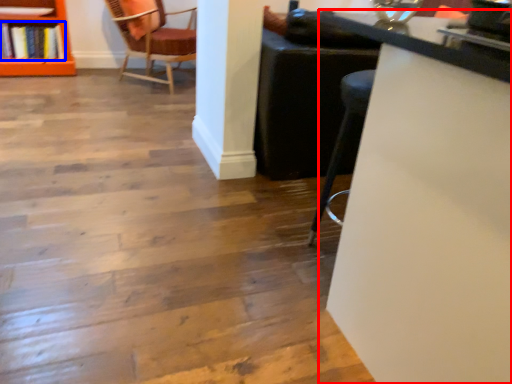
Question: Which object is further to the camera taking this photo, table (highlighted by a red box) or book (highlighted by a blue box)?

Choices:
 (A) table
 (B) book

Answer: (B)